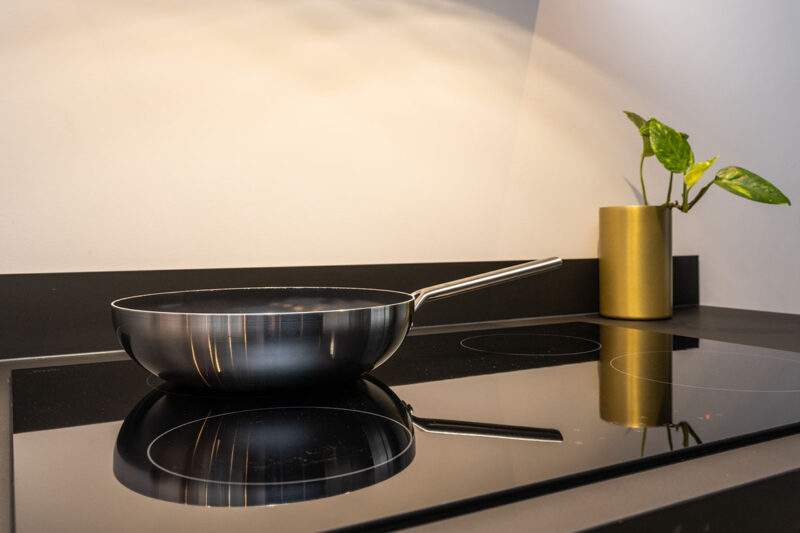
In order to click on green plant leaves, possibly golden pothos in this screenshot , I will do `click(678, 153)`.